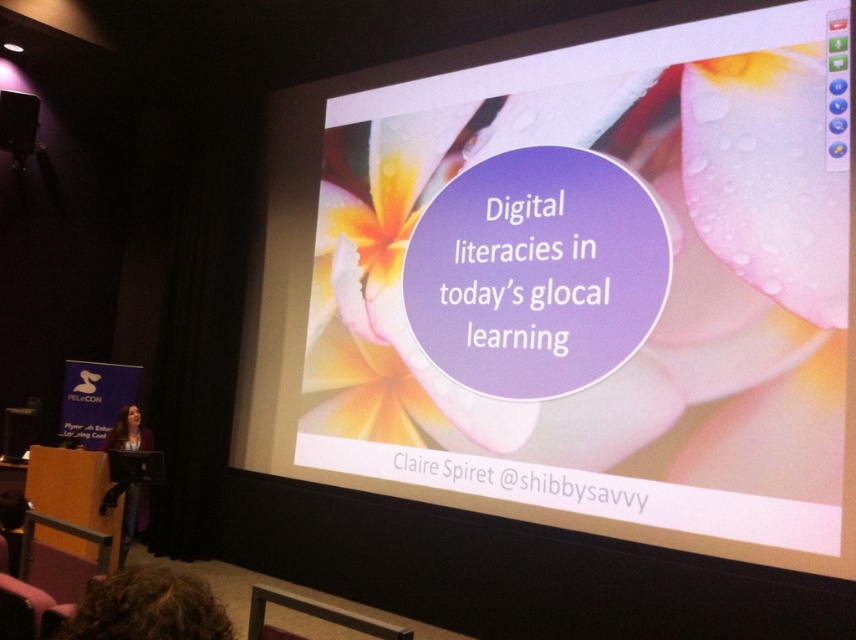
You are an event planner setting up a conference room. You need to position a 2.5 meter wide banner between the white glossy projection screen at upper center and the matte black podium at left. Can the banner fit without overlapping either object?

The distance between the white glossy projection screen at upper center and the matte black podium at left is 3.39 meters. Since the banner is 2.5 meters wide, it can fit between them without overlapping as 2.5 meters is less than 3.39 meters.

In the scene shown: You are an attendee at the presentation and you want to take a photo of the presenter. The curly hair at lower left and the dark purple sweater at lower left are both in the frame. Which one is closer to the camera?

The curly hair at lower left is shorter than the dark purple sweater at lower left, so the curly hair at lower left is closer to the camera.

Based on the photo, you are an attendee at the presentation and want to take a photo of the slide on the white glossy projection screen at upper center without including the curly hair at lower left in the frame. Is this possible given their sizes?

The white glossy projection screen at upper center is taller than curly hair at lower left, so yes, it is possible to take a photo of the slide on the white glossy projection screen at upper center without including the curly hair at lower left in the frame by adjusting the camera angle or zoom to focus solely on the larger screen.